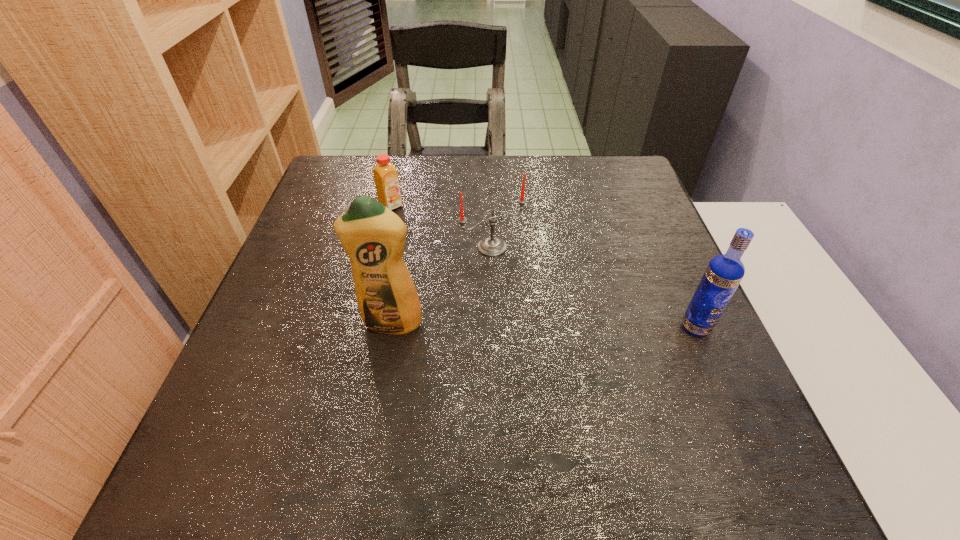
Locate which object ranks third in proximity to the rightmost object. Please provide its 2D coordinates. Your answer should be formatted as a tuple, i.e. [(x, y)], where the tuple contains the x and y coordinates of a point satisfying the conditions above.

[(386, 178)]

Where is `object that is the second nearest to the farthest object`? Image resolution: width=960 pixels, height=540 pixels. object that is the second nearest to the farthest object is located at coordinates (373, 236).